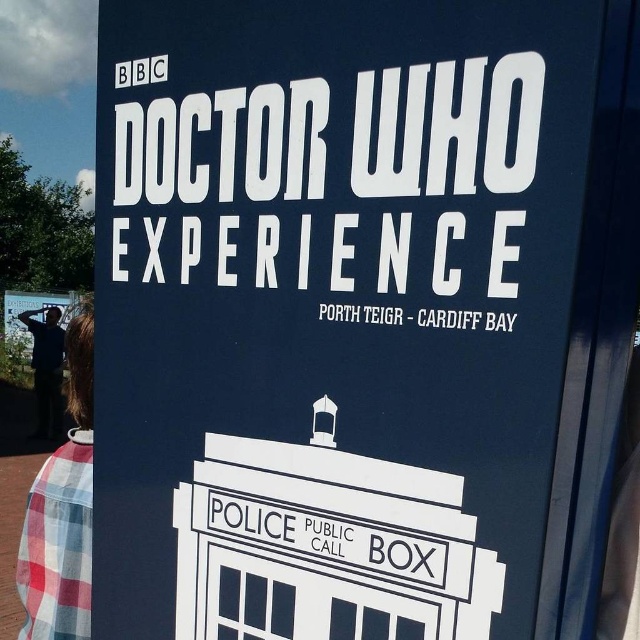
Which is below, plaid shirt at lower left or dark blue shirt at left?

dark blue shirt at left is lower down.

Who is more forward, (74, 323) or (42, 356)?

Point (74, 323) is more forward.

Does point (84, 314) come farther from viewer compared to point (54, 339)?

No.

Locate an element on the screen. This screenshot has width=640, height=640. plaid shirt at lower left is located at coordinates (61, 512).